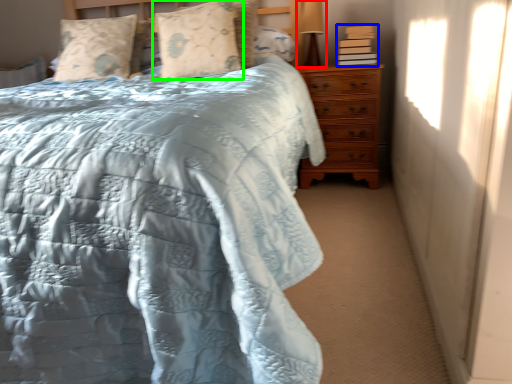
Question: Estimate the real-world distances between objects in this image. Which object is farther from table lamp (highlighted by a red box), book (highlighted by a blue box) or pillow (highlighted by a green box)?

Choices:
 (A) book
 (B) pillow

Answer: (B)